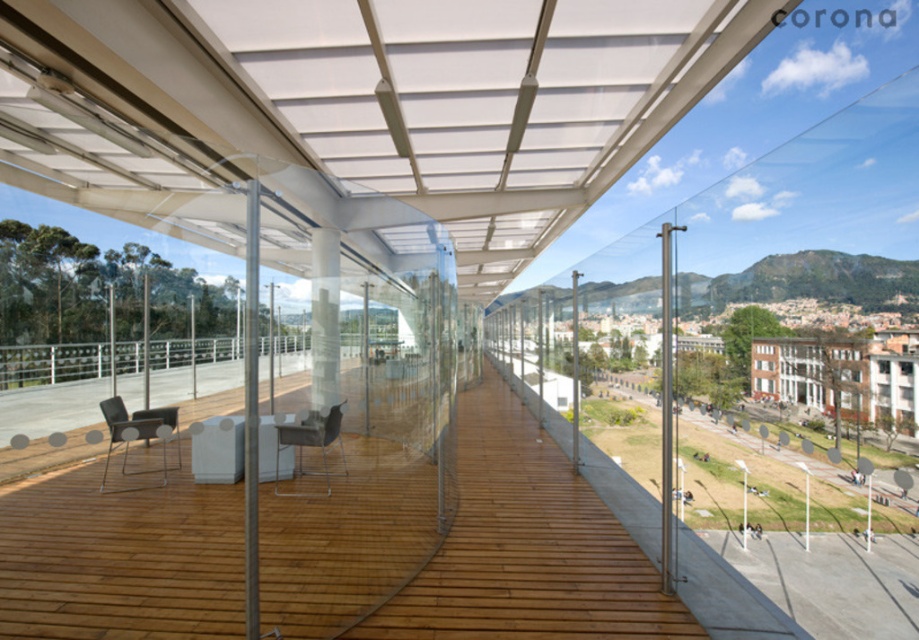
Between point (146, 486) and point (298, 465), which one is positioned behind?

The point (298, 465) is behind.

Between point (100, 401) and point (295, 429), which one is positioned in front?

Positioned in front is point (295, 429).

I want to click on matte black chair at lower left, so click(135, 432).

Is point (180, 600) more distant than point (342, 403)?

No, it is in front of (342, 403).

Which of these two, wooden deck at center or metallic silver chair at center, stands shorter?

wooden deck at center

Which is in front, point (477, 576) or point (318, 426)?

Point (477, 576) is more forward.

Where is `wooden deck at center`? The image size is (919, 640). wooden deck at center is located at coordinates (461, 545).

Is wooden deck at center to the left of matte black chair at lower left from the viewer's perspective?

No, wooden deck at center is not to the left of matte black chair at lower left.

Does point (484, 442) come closer to viewer compared to point (150, 410)?

No.

Find the location of a particular element. wooden deck at center is located at coordinates (461, 545).